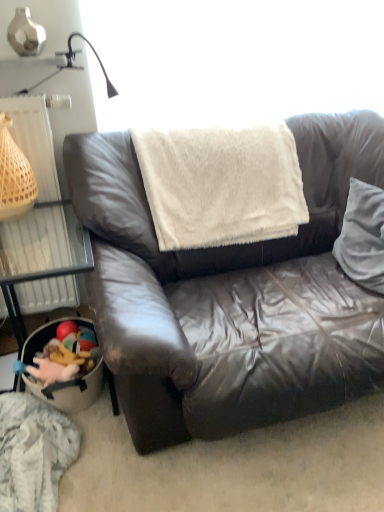
Question: From the image's perspective, is beige woven basket at left over plush toy at lower left?

Choices:
 (A) yes
 (B) no

Answer: (A)

Question: Is beige woven basket at left smaller than plush toy at lower left?

Choices:
 (A) no
 (B) yes

Answer: (A)

Question: Can we say beige woven basket at left lies outside plush toy at lower left?

Choices:
 (A) yes
 (B) no

Answer: (A)

Question: Is beige woven basket at left taller than plush toy at lower left?

Choices:
 (A) yes
 (B) no

Answer: (A)

Question: Can you confirm if beige woven basket at left is thinner than plush toy at lower left?

Choices:
 (A) no
 (B) yes

Answer: (A)

Question: From a real-world perspective, does beige woven basket at left stand above plush toy at lower left?

Choices:
 (A) no
 (B) yes

Answer: (B)

Question: Can you confirm if white soft pillow at right is wider than beige woven basket at left?

Choices:
 (A) no
 (B) yes

Answer: (B)

Question: Can you confirm if white soft pillow at right is thinner than beige woven basket at left?

Choices:
 (A) yes
 (B) no

Answer: (B)

Question: From the image's perspective, would you say white soft pillow at right is shown under beige woven basket at left?

Choices:
 (A) no
 (B) yes

Answer: (B)

Question: Does white soft pillow at right appear on the left side of beige woven basket at left?

Choices:
 (A) yes
 (B) no

Answer: (B)

Question: Is white soft pillow at right far from beige woven basket at left?

Choices:
 (A) yes
 (B) no

Answer: (A)

Question: Is white soft pillow at right bigger than beige woven basket at left?

Choices:
 (A) no
 (B) yes

Answer: (B)

Question: From a real-world perspective, is white plastic radiator at left over plush toy at lower left?

Choices:
 (A) no
 (B) yes

Answer: (B)